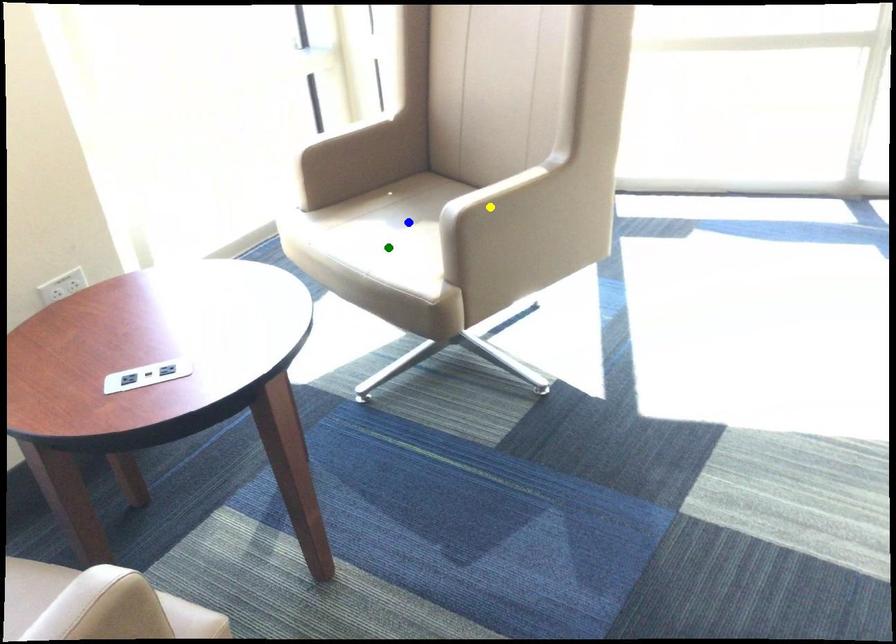
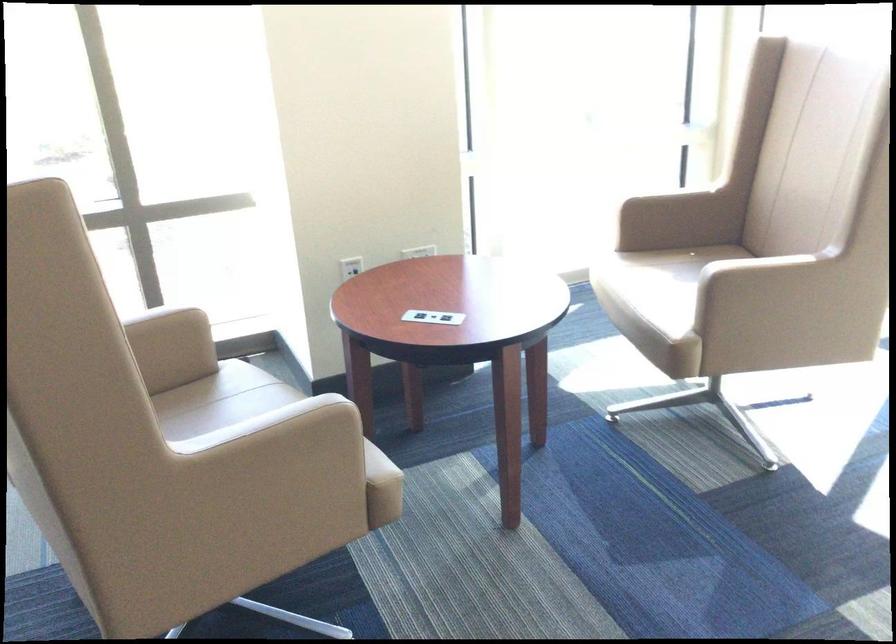
I am providing you with two images of the same scene from different viewpoints. Three points are marked in image1. Which point corresponds to a part or object that is occluded in image2?In image1, three points are marked. Which of them correspond to a part or object that is occluded in image2?Among the three points shown in image1, which one corresponds to a part or object that is no longer visible due to occlusion in image2?

Invisible in image2: blue point.